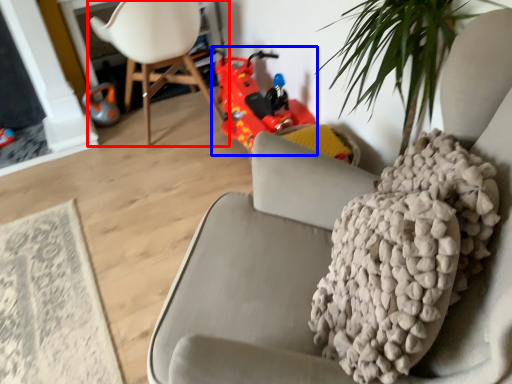
Question: Which object appears closest to the camera in this image, chair (highlighted by a red box) or toy car (highlighted by a blue box)?

Choices:
 (A) chair
 (B) toy car

Answer: (A)